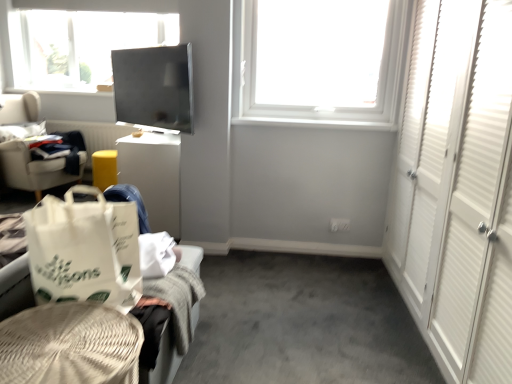
Question: In terms of size, does white paper shopping bag at lower left appear bigger or smaller than white cardboard box at center-left?

Choices:
 (A) big
 (B) small

Answer: (B)

Question: In the image, is white paper shopping bag at lower left positioned in front of or behind white cardboard box at center-left?

Choices:
 (A) behind
 (B) front

Answer: (B)

Question: Which of these objects is positioned closest to the matte black screen at upper center?

Choices:
 (A) white cardboard box at center-left
 (B) white plastic window at upper center
 (C) light gray fabric chair at left
 (D) white woven basket at lower left, the 2th furniture positioned from the front
 (E) woven beige basket at lower left, acting as the 2th furniture starting from the back

Answer: (A)

Question: Based on their relative distances, which object is nearer to the light gray fabric chair at left?

Choices:
 (A) matte black screen at upper center
 (B) woven beige basket at lower left, marked as the 1th furniture in a front-to-back arrangement
 (C) white paper shopping bag at lower left
 (D) white cardboard box at center-left
 (E) white plastic window at upper center

Answer: (D)